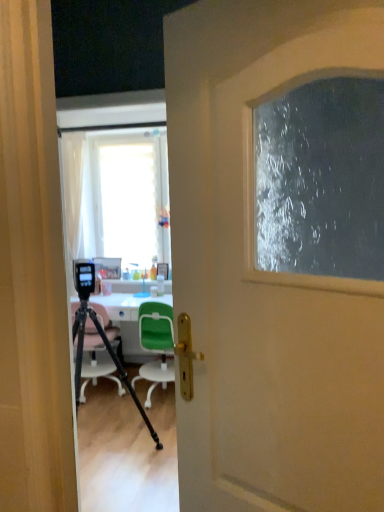
This screenshot has width=384, height=512. Describe the element at coordinates (96, 361) in the screenshot. I see `pink plastic chair at center, the second chair from the right` at that location.

What is the approximate height of pink plastic chair at center, the second chair from the right?

pink plastic chair at center, the second chair from the right, is 33.47 inches tall.

Locate an element on the screen. This screenshot has height=512, width=384. green plastic chair at center, the second chair positioned from the left is located at coordinates (156, 345).

You are a GUI agent. You are given a task and a screenshot of the screen. Output one action in this format:
    pyautogui.click(x=<x>, y=<y>)
    Task: Click on the black matte tripod at center
    This screenshot has width=384, height=512.
    Given the screenshot: What is the action you would take?
    pyautogui.click(x=111, y=356)

You are a GUI agent. You are given a task and a screenshot of the screen. Output one action in this format:
    pyautogui.click(x=<x>, y=<y>)
    Task: Click on the translucent plastic bottle at center
    
    Given the screenshot: What is the action you would take?
    pyautogui.click(x=160, y=285)

Describe the element at coordinates (266, 273) in the screenshot. This screenshot has width=384, height=512. I see `white matte door at center` at that location.

I want to click on white glossy desk at center, so click(x=125, y=305).

Considering the sizes of black matte tripod at center and white matte door at center in the image, is black matte tripod at center bigger or smaller than white matte door at center?

black matte tripod at center is bigger than white matte door at center.

In terms of height, does black matte tripod at center look taller or shorter compared to white matte door at center?

black matte tripod at center is shorter than white matte door at center.

Is black matte tripod at center wider than white matte door at center?

Indeed, black matte tripod at center has a greater width compared to white matte door at center.

Which object is further away from the camera, black matte tripod at center or white matte door at center?

black matte tripod at center is behind.

Considering the positions of objects white matte door at center and pink plastic chair at center, positioned as the 1th chair in left-to-right order, in the image provided, who is behind, white matte door at center or pink plastic chair at center, positioned as the 1th chair in left-to-right order,?

pink plastic chair at center, positioned as the 1th chair in left-to-right order.

Does point (338, 293) come closer to viewer compared to point (97, 340)?

Yes, it is.

Considering the relative sizes of white matte door at center and pink plastic chair at center, the second chair from the right, in the image provided, is white matte door at center taller than pink plastic chair at center, the second chair from the right,?

Yes.

How many degrees apart are the facing directions of white matte door at center and pink plastic chair at center, positioned as the 1th chair in left-to-right order?

There is a 148-degree angle between the facing directions of white matte door at center and pink plastic chair at center, positioned as the 1th chair in left-to-right order.

Is translucent plastic bottle at center further to camera compared to green plastic chair at center, the second chair positioned from the left?

That is True.

Locate an element on the screen. Image resolution: width=384 pixels, height=512 pixels. bottle behind the green plastic chair at center, placed as the first chair when sorted from right to left is located at coordinates (160, 285).

Based on the photo, from a real-world perspective, which object stands above the other?

In real-world perspective, translucent plastic bottle at center is above.

Which object is positioned more to the right, translucent plastic bottle at center or green plastic chair at center, placed as the first chair when sorted from right to left?

From the viewer's perspective, translucent plastic bottle at center appears more on the right side.

Would you consider translucent plastic bottle at center to be distant from pink plastic chair at center, positioned as the 1th chair in left-to-right order?

They are positioned close to each other.

Is the position of translucent plastic bottle at center more distant than that of pink plastic chair at center, the second chair from the right?

Yes, it is.

Can we say translucent plastic bottle at center lies outside pink plastic chair at center, positioned as the 1th chair in left-to-right order?

Yes, translucent plastic bottle at center is not within pink plastic chair at center, positioned as the 1th chair in left-to-right order.

Is translucent plastic bottle at center positioned far away from white matte door at center?

translucent plastic bottle at center is positioned a significant distance from white matte door at center.

Where is `door above the translucent plastic bottle at center (from the image's perspective)`? This screenshot has width=384, height=512. door above the translucent plastic bottle at center (from the image's perspective) is located at coordinates (266, 273).

Does translucent plastic bottle at center have a greater height compared to white matte door at center?

Incorrect, the height of translucent plastic bottle at center is not larger of that of white matte door at center.

The width and height of the screenshot is (384, 512). I want to click on chair that appears in front of the pink plastic chair at center, the second chair from the right, so click(156, 345).

Is green plastic chair at center, the second chair positioned from the left, positioned beyond the bounds of pink plastic chair at center, positioned as the 1th chair in left-to-right order?

Absolutely, green plastic chair at center, the second chair positioned from the left, is external to pink plastic chair at center, positioned as the 1th chair in left-to-right order.

From a real-world perspective, is green plastic chair at center, placed as the first chair when sorted from right to left, positioned under pink plastic chair at center, the second chair from the right, based on gravity?

Yes, from a real-world perspective, green plastic chair at center, placed as the first chair when sorted from right to left, is under pink plastic chair at center, the second chair from the right.

Is green plastic chair at center, placed as the first chair when sorted from right to left, positioned with its back to pink plastic chair at center, positioned as the 1th chair in left-to-right order?

That's not correct — green plastic chair at center, placed as the first chair when sorted from right to left, is not looking away from pink plastic chair at center, positioned as the 1th chair in left-to-right order.

From a real-world perspective, is black matte tripod at center positioned above or below translucent plastic bottle at center?

black matte tripod at center is below translucent plastic bottle at center.

In terms of size, does black matte tripod at center appear bigger or smaller than translucent plastic bottle at center?

Clearly, black matte tripod at center is larger in size than translucent plastic bottle at center.

Which is farther from the camera, [148,422] or [158,288]?

The point [158,288] is farther.

Is black matte tripod at center oriented away from translucent plastic bottle at center?

Yes, black matte tripod at center's orientation is away from translucent plastic bottle at center.

What are the coordinates of `door on the right of black matte tripod at center` in the screenshot? It's located at (266, 273).

Find the location of a particular element. The width and height of the screenshot is (384, 512). door above the pink plastic chair at center, positioned as the 1th chair in left-to-right order (from the image's perspective) is located at coordinates click(x=266, y=273).

Estimate the real-world distances between objects in this image. Which object is closer to pink plastic chair at center, positioned as the 1th chair in left-to-right order, white glossy desk at center or translucent plastic bottle at center?

white glossy desk at center lies closer to pink plastic chair at center, positioned as the 1th chair in left-to-right order, than the other object.

Looking at the image, which one is located further to translucent plastic bottle at center, pink plastic chair at center, positioned as the 1th chair in left-to-right order, or black matte tripod at center?

black matte tripod at center is further to translucent plastic bottle at center.

From the image, which object appears to be nearer to translucent plastic bottle at center, black matte tripod at center or white matte door at center?

black matte tripod at center is closer to translucent plastic bottle at center.

Which object lies further to the anchor point white glossy desk at center, translucent plastic bottle at center or pink plastic chair at center, positioned as the 1th chair in left-to-right order?

translucent plastic bottle at center is further to white glossy desk at center.

When comparing their distances from translucent plastic bottle at center, does green plastic chair at center, placed as the first chair when sorted from right to left, or pink plastic chair at center, the second chair from the right, seem further?

pink plastic chair at center, the second chair from the right, is further to translucent plastic bottle at center.

Which object lies nearer to the anchor point green plastic chair at center, placed as the first chair when sorted from right to left, pink plastic chair at center, positioned as the 1th chair in left-to-right order, or white matte door at center?

The object closer to green plastic chair at center, placed as the first chair when sorted from right to left, is pink plastic chair at center, positioned as the 1th chair in left-to-right order.

Looking at the image, which one is located closer to white matte door at center, green plastic chair at center, placed as the first chair when sorted from right to left, or pink plastic chair at center, the second chair from the right?

Among the two, green plastic chair at center, placed as the first chair when sorted from right to left, is located nearer to white matte door at center.

Estimate the real-world distances between objects in this image. Which object is further from translucent plastic bottle at center, white matte door at center or black matte tripod at center?

Based on the image, white matte door at center appears to be further to translucent plastic bottle at center.

The width and height of the screenshot is (384, 512). Identify the location of chair between green plastic chair at center, placed as the first chair when sorted from right to left, and translucent plastic bottle at center in the front-back direction. point(96,361).

The width and height of the screenshot is (384, 512). Find the location of `chair located between black matte tripod at center and pink plastic chair at center, positioned as the 1th chair in left-to-right order, in the depth direction`. chair located between black matte tripod at center and pink plastic chair at center, positioned as the 1th chair in left-to-right order, in the depth direction is located at coordinates (156, 345).

The width and height of the screenshot is (384, 512). In order to click on desk between white matte door at center and translucent plastic bottle at center from front to back in this screenshot , I will do click(x=125, y=305).

You are a GUI agent. You are given a task and a screenshot of the screen. Output one action in this format:
    pyautogui.click(x=<x>, y=<y>)
    Task: Click on the tripod located between white matte door at center and green plastic chair at center, the second chair positioned from the left, in the depth direction
    
    Given the screenshot: What is the action you would take?
    pyautogui.click(x=111, y=356)